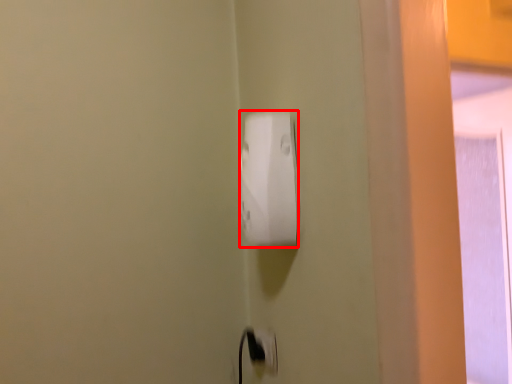
Question: From the image's perspective, considering the relative positions of power plugs and sockets (annotated by the red box) and electric outlet in the image provided, where is power plugs and sockets (annotated by the red box) located with respect to the staircase?

Choices:
 (A) below
 (B) above

Answer: (B)